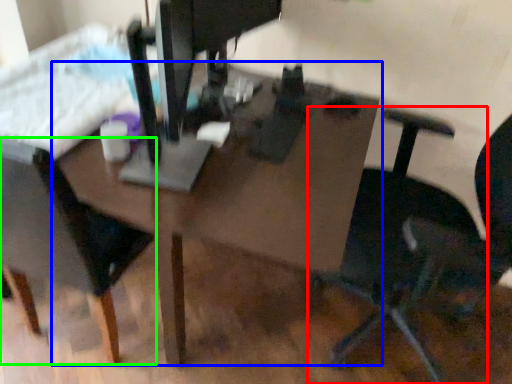
Question: Which is nearer to the chair (highlighted by a red box)? table (highlighted by a blue box) or chair (highlighted by a green box).

Choices:
 (A) table
 (B) chair

Answer: (A)